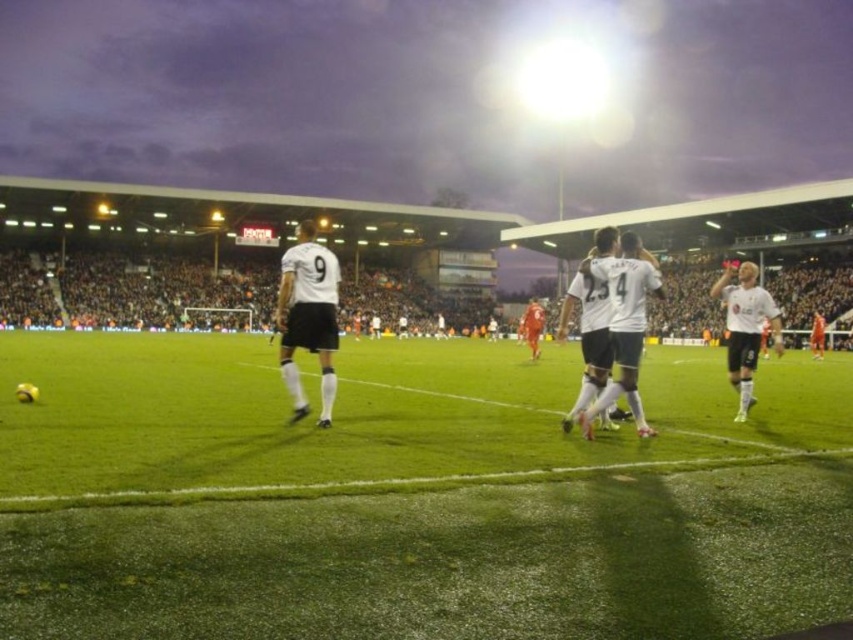
The height and width of the screenshot is (640, 853). Find the location of `white matte jersey at center`. white matte jersey at center is located at coordinates (308, 317).

Can you confirm if white matte jersey at center is wider than white jersey at center?

Yes, white matte jersey at center is wider than white jersey at center.

Where is `white matte jersey at center`? The width and height of the screenshot is (853, 640). white matte jersey at center is located at coordinates (308, 317).

Between white jersey at center and white matte jersey at right, which one appears on the left side from the viewer's perspective?

white jersey at center is more to the left.

Which is more to the right, white jersey at center or white matte jersey at right?

From the viewer's perspective, white matte jersey at right appears more on the right side.

In order to click on white jersey at center in this screenshot , I will do `click(624, 323)`.

This screenshot has width=853, height=640. Identify the location of white jersey at center. pyautogui.click(x=624, y=323).

Who is positioned more to the right, white matte jersey at center or white matte jersey at right?

white matte jersey at right

The height and width of the screenshot is (640, 853). What do you see at coordinates (308, 317) in the screenshot? I see `white matte jersey at center` at bounding box center [308, 317].

Is point (300, 321) less distant than point (751, 307)?

Yes, it is.

Where is `white matte jersey at center`? The height and width of the screenshot is (640, 853). white matte jersey at center is located at coordinates (308, 317).